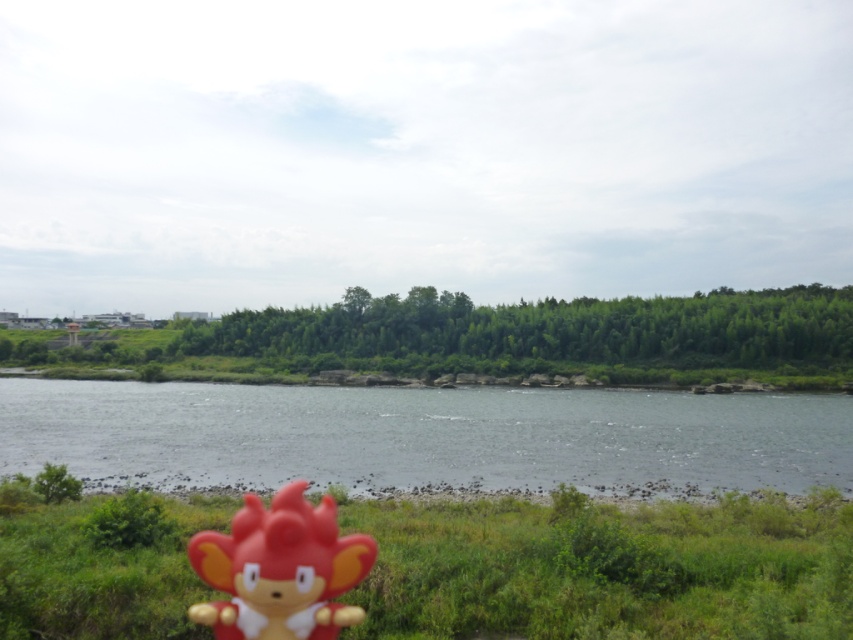
Question: Considering the real-world distances, which object is closest to the green matte grass at lower center?

Choices:
 (A) glossy water at center
 (B) matte plastic toy at lower center

Answer: (B)

Question: Can you confirm if green matte grass at lower center is wider than matte plastic toy at lower center?

Choices:
 (A) yes
 (B) no

Answer: (A)

Question: Considering the real-world distances, which object is farthest from the matte plastic toy at lower center?

Choices:
 (A) green matte grass at lower center
 (B) glossy water at center

Answer: (B)

Question: Does green matte grass at lower center come behind matte plastic toy at lower center?

Choices:
 (A) yes
 (B) no

Answer: (A)

Question: Considering the relative positions of glossy water at center and matte plastic toy at lower center in the image provided, where is glossy water at center located with respect to matte plastic toy at lower center?

Choices:
 (A) above
 (B) below

Answer: (B)

Question: Which object appears closest to the camera in this image?

Choices:
 (A) green matte grass at lower center
 (B) matte plastic toy at lower center

Answer: (B)